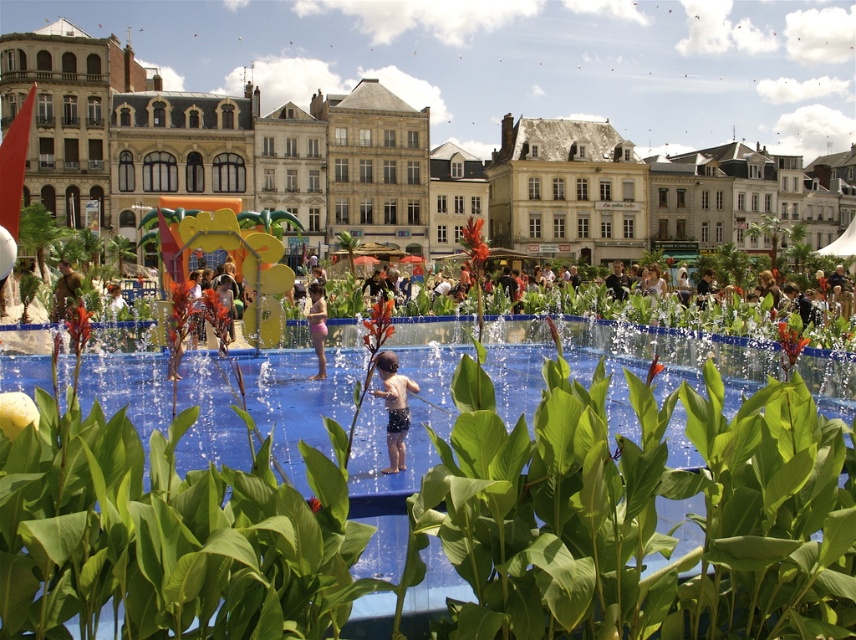
Consider the image. Is blue swim trunks at center below camouflage fabric person at center?

Indeed, blue swim trunks at center is positioned under camouflage fabric person at center.

This screenshot has width=856, height=640. I want to click on blue swim trunks at center, so click(394, 406).

Where is `blue swim trunks at center`? The height and width of the screenshot is (640, 856). blue swim trunks at center is located at coordinates (394, 406).

What are the coordinates of `blue swim trunks at center` in the screenshot? It's located at (394, 406).

Which is more to the left, pink fabric at center or camouflage fabric person at center?

Positioned to the left is camouflage fabric person at center.

Which is more to the right, pink fabric at center or camouflage fabric person at center?

Positioned to the right is pink fabric at center.

Find the location of a particular element. The image size is (856, 640). pink fabric at center is located at coordinates (317, 324).

Is matte orange playground at center below camouflage fabric person at center?

Incorrect, matte orange playground at center is not positioned below camouflage fabric person at center.

Between point (107, 17) and point (72, 278), which one is positioned in front?

Point (72, 278) is in front.

This screenshot has width=856, height=640. Describe the element at coordinates (516, 60) in the screenshot. I see `matte orange playground at center` at that location.

I want to click on matte orange playground at center, so click(516, 60).